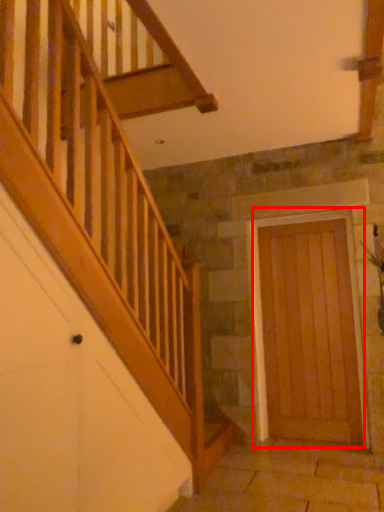
Question: From the image's perspective, what is the correct spatial positioning of door (annotated by the red box) in reference to plant?

Choices:
 (A) below
 (B) above

Answer: (A)